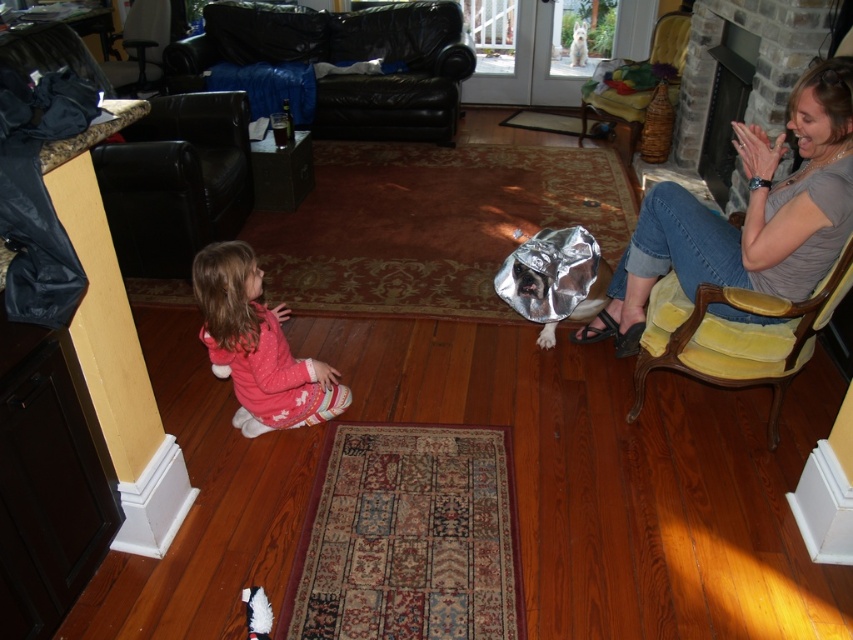
You are a delivery person trying to place a package between the denim jeans at right and the black leather couch at upper left. The package requires 8 feet of space. Is there enough space between them?

The denim jeans at right and black leather couch at upper left are 10.00 feet apart from each other, so yes, there is enough space to place the package between them since 10 feet is greater than the required 8 feet.

You are a delivery person arriving at the house and need to place a package between the pink fleece pants at lower left and the velvet yellow armchair at upper right. The package requires a space of 3 meters. Can you fit it there?

The distance between the pink fleece pants at lower left and the velvet yellow armchair at upper right is 3.43 meters, so yes, the package can be placed there as the required space of 3 meters is available.

You are a delivery person trying to place a large package in this living room. The package is 1.2 meters wide. You see the pink fleece pants at lower left and the velvet yellow armchair at upper right. Which object has a width that could help determine if the package will fit between them?

The pink fleece pants at lower left is narrower than the velvet yellow armchair at upper right. Since the package is 1.2 meters wide, you need to check the width of the narrower object, which is the pink fleece pants at lower left. If the space between them is at least 1.2 meters, the package can fit.